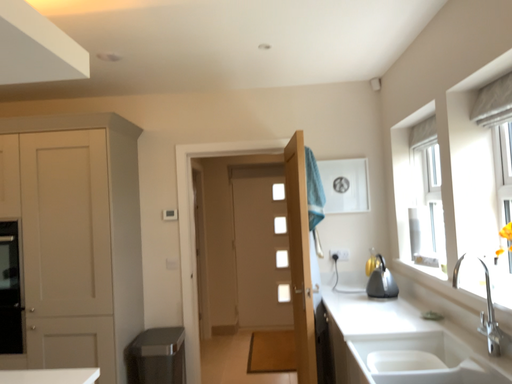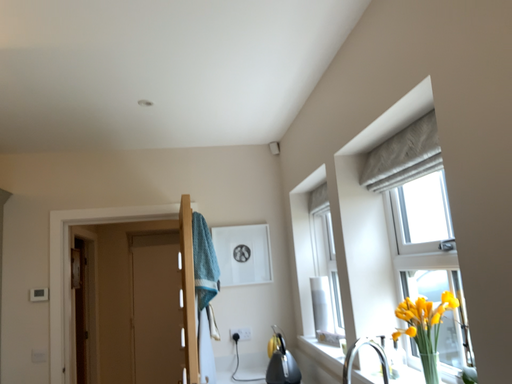
Question: How did the camera likely rotate when shooting the video?

Choices:
 (A) rotated downward
 (B) rotated upward

Answer: (B)